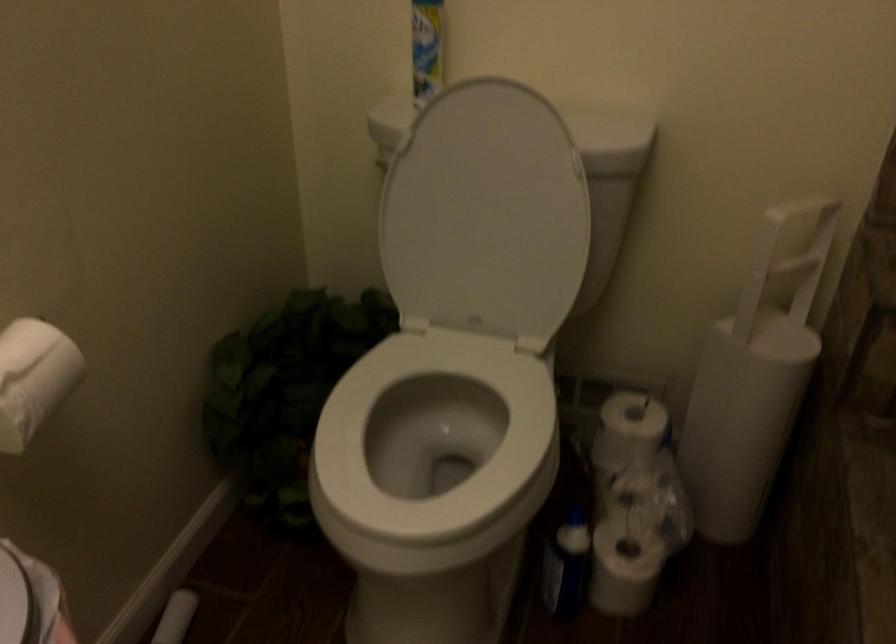
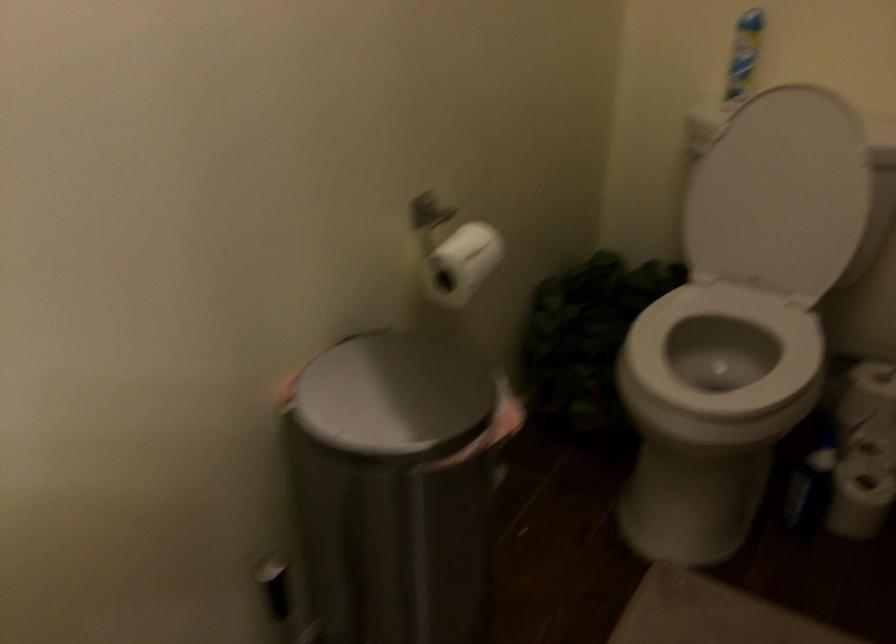
Question: The images are taken continuously from a first-person perspective. In which direction is your viewpoint rotating?

Choices:
 (A) Left
 (B) Right
 (C) Up
 (D) Down

Answer: (A)